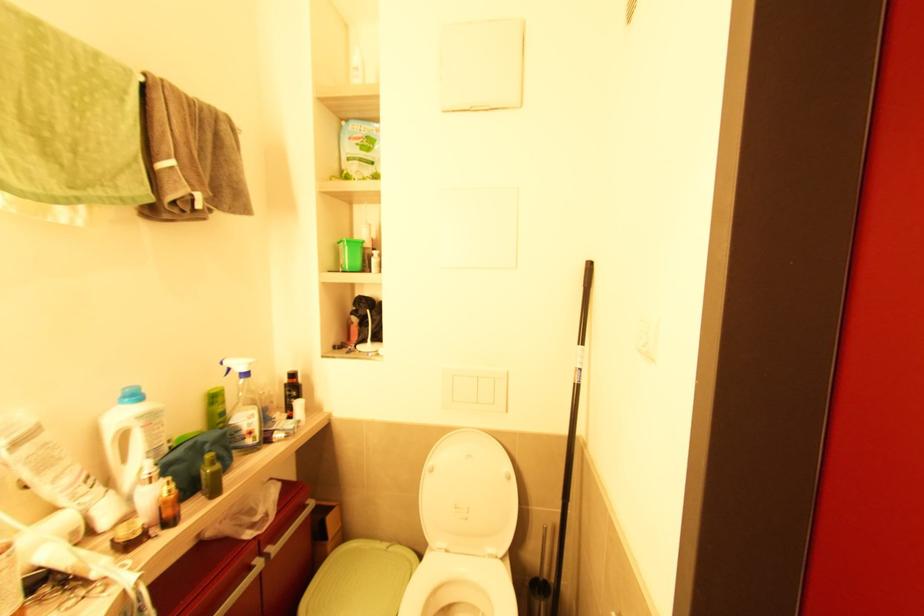
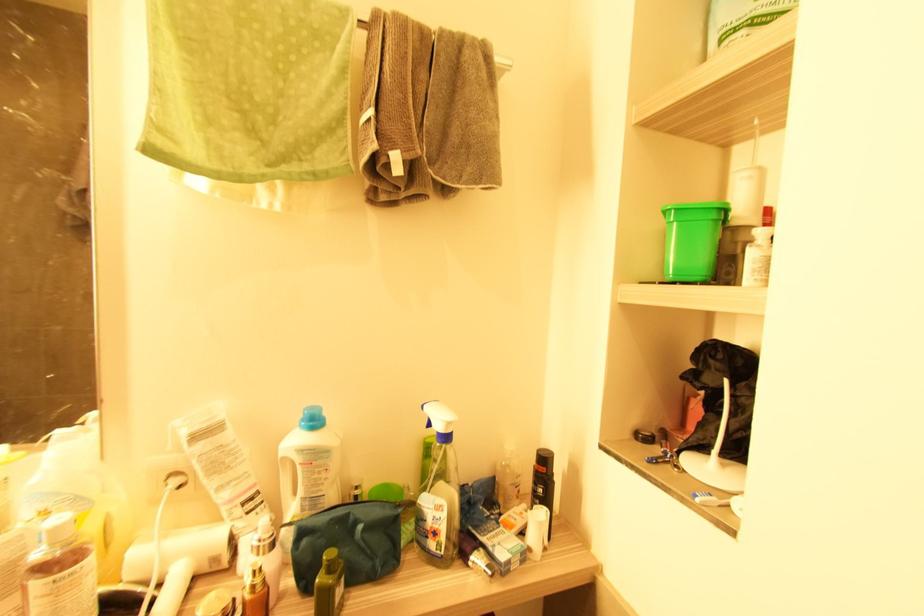
Find the pixel in the second image that matches [297,381] in the first image.

(545, 469)